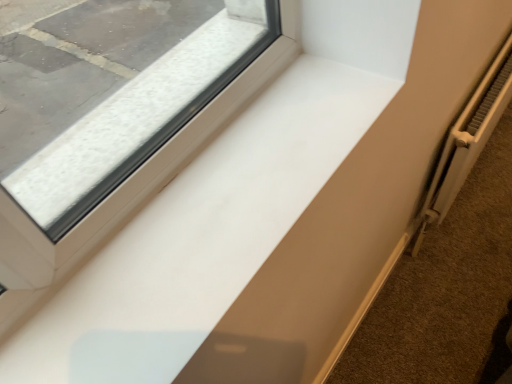
Question: Could you tell me if white matte radiator at lower right is facing white metallic radiator at right?

Choices:
 (A) yes
 (B) no

Answer: (B)

Question: Considering the relative sizes of white matte radiator at lower right and white metallic radiator at right in the image provided, is white matte radiator at lower right taller than white metallic radiator at right?

Choices:
 (A) no
 (B) yes

Answer: (A)

Question: Is white matte radiator at lower right positioned behind white metallic radiator at right?

Choices:
 (A) yes
 (B) no

Answer: (A)

Question: Does white matte radiator at lower right appear on the left side of white metallic radiator at right?

Choices:
 (A) no
 (B) yes

Answer: (B)

Question: Is white matte radiator at lower right with white metallic radiator at right?

Choices:
 (A) yes
 (B) no

Answer: (B)

Question: Is white glossy window sill at center taller or shorter than white matte radiator at lower right?

Choices:
 (A) short
 (B) tall

Answer: (A)

Question: Considering the positions of white glossy window sill at center and white matte radiator at lower right in the image, is white glossy window sill at center wider or thinner than white matte radiator at lower right?

Choices:
 (A) thin
 (B) wide

Answer: (A)

Question: Choose the correct answer: Is white glossy window sill at center inside white matte radiator at lower right or outside it?

Choices:
 (A) outside
 (B) inside

Answer: (A)

Question: Relative to white matte radiator at lower right, is white glossy window sill at center in front or behind?

Choices:
 (A) front
 (B) behind

Answer: (A)

Question: Considering the relative positions of white matte radiator at lower right and white glossy window sill at center in the image provided, is white matte radiator at lower right to the left or to the right of white glossy window sill at center?

Choices:
 (A) left
 (B) right

Answer: (B)

Question: Does point (441, 309) appear closer or farther from the camera than point (266, 66)?

Choices:
 (A) farther
 (B) closer

Answer: (A)

Question: From the image's perspective, is white matte radiator at lower right above or below white glossy window sill at center?

Choices:
 (A) above
 (B) below

Answer: (B)

Question: In terms of height, does white matte radiator at lower right look taller or shorter compared to white glossy window sill at center?

Choices:
 (A) short
 (B) tall

Answer: (B)

Question: Is white glossy window sill at center taller or shorter than white metallic radiator at right?

Choices:
 (A) short
 (B) tall

Answer: (A)

Question: From a real-world perspective, is white glossy window sill at center physically located above or below white metallic radiator at right?

Choices:
 (A) above
 (B) below

Answer: (A)